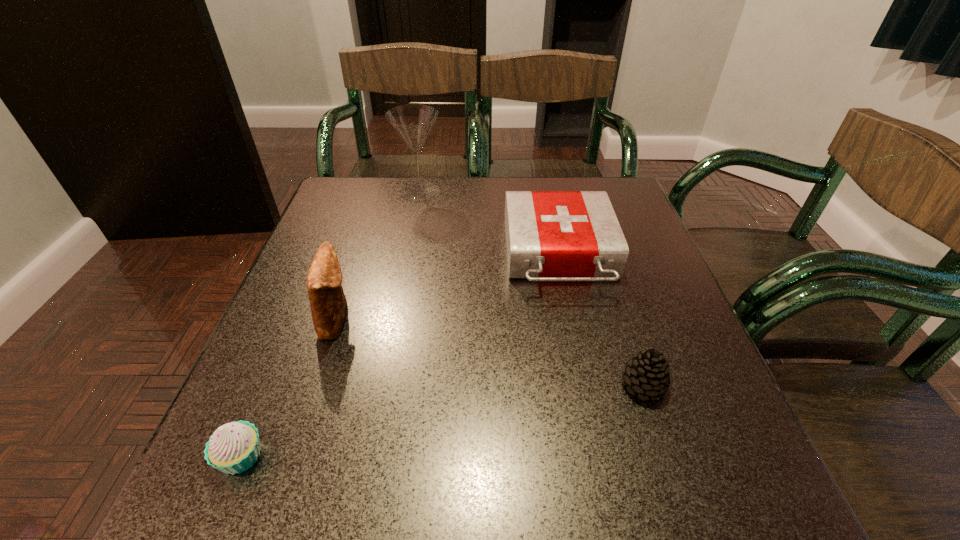
This screenshot has height=540, width=960. What are the coordinates of `vacant space situated at the narrow end of the pinecone` in the screenshot? It's located at (399, 384).

You are a GUI agent. You are given a task and a screenshot of the screen. Output one action in this format:
    pyautogui.click(x=<x>, y=<y>)
    Task: Click on the free spot located at the narrow end of the pinecone
    The height and width of the screenshot is (540, 960).
    Given the screenshot: What is the action you would take?
    pyautogui.click(x=469, y=384)

Locate an element on the screen. Image resolution: width=960 pixels, height=540 pixels. vacant space positioned at the narrow end of the pinecone is located at coordinates (487, 384).

Image resolution: width=960 pixels, height=540 pixels. What are the coordinates of `vacant space situated 0.320m on the front side of the first-aid kit` in the screenshot? It's located at (602, 452).

The image size is (960, 540). What are the coordinates of `vacant space located on the right of the leftmost object` in the screenshot? It's located at (392, 456).

The height and width of the screenshot is (540, 960). Find the location of `flute glass at the far edge`. flute glass at the far edge is located at coordinates click(x=413, y=122).

Where is `the first-aid kit at the far edge`? Image resolution: width=960 pixels, height=540 pixels. the first-aid kit at the far edge is located at coordinates [550, 235].

Locate an element on the screen. This screenshot has height=540, width=960. object positioned at the near edge is located at coordinates (234, 447).

At what (x,y) coordinates should I click in order to perform the action: click on clutch bag present at the left edge. Please return your answer as a coordinate pair (x, y). Looking at the image, I should click on (328, 304).

The image size is (960, 540). What are the coordinates of `cupcake situated at the left edge` in the screenshot? It's located at (234, 447).